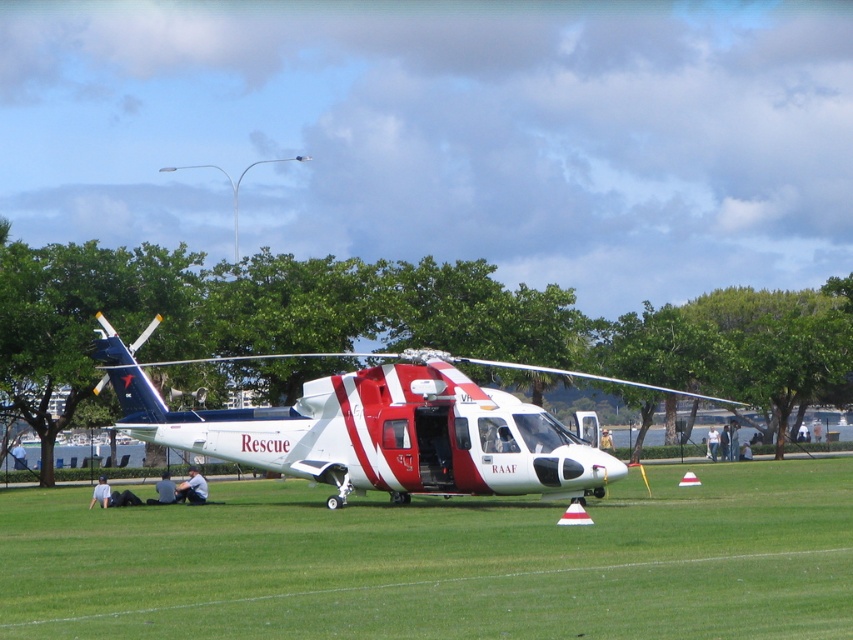
Question: Observing the image, what is the correct spatial positioning of green grass at center in reference to red and white rescue helicopter at center?

Choices:
 (A) below
 (B) above

Answer: (A)

Question: Does green grass at center have a larger size compared to red and white rescue helicopter at center?

Choices:
 (A) no
 (B) yes

Answer: (B)

Question: Does green grass at center appear over red and white rescue helicopter at center?

Choices:
 (A) yes
 (B) no

Answer: (B)

Question: Which of the following is the farthest from the observer?

Choices:
 (A) green grass at center
 (B) red and white rescue helicopter at center

Answer: (B)

Question: Which of the following is the closest to the observer?

Choices:
 (A) red and white rescue helicopter at center
 (B) green grass at center

Answer: (B)